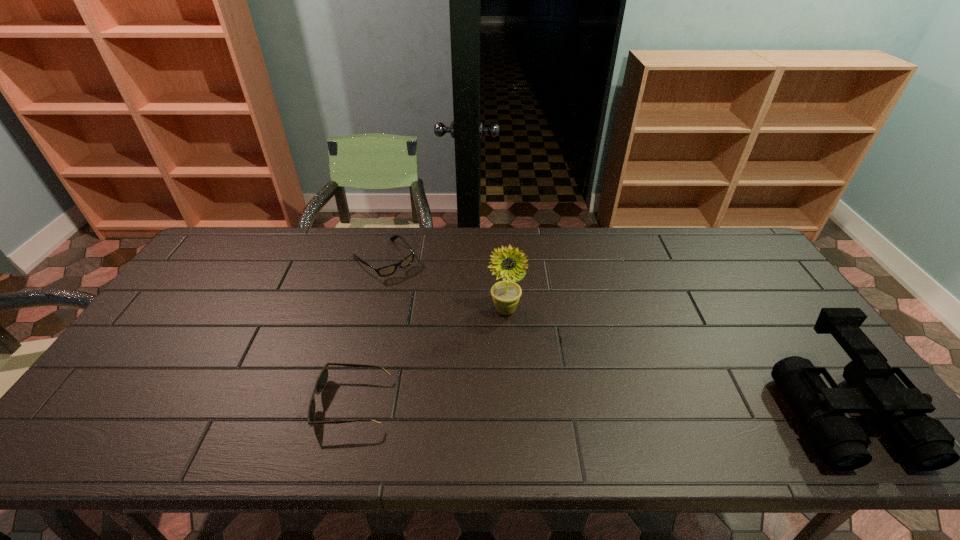
The height and width of the screenshot is (540, 960). I want to click on vacant region between the sunglasses and the binoculars, so click(595, 406).

Find the location of a particular element. This screenshot has height=540, width=960. unoccupied position between the farthest object and the sunflower is located at coordinates (444, 285).

At what (x,y) coordinates should I click in order to perform the action: click on free space between the farthest object and the tallest object. Please return your answer as a coordinate pair (x, y). Looking at the image, I should click on (444, 285).

Where is `vacant region between the spectacles and the rightmost object`? The height and width of the screenshot is (540, 960). vacant region between the spectacles and the rightmost object is located at coordinates (612, 335).

I want to click on the closest object relative to the spectacles, so click(506, 294).

At what (x,y) coordinates should I click in order to perform the action: click on object that is the second closest to the spectacles. Please return your answer as a coordinate pair (x, y). Looking at the image, I should click on (322, 379).

At what (x,y) coordinates should I click in order to perform the action: click on free space that satisfies the following two spatial constraints: 1. on the front side of the sunglasses; 2. on the lenses of the farthest object. Please return your answer as a coordinate pair (x, y). The height and width of the screenshot is (540, 960). Looking at the image, I should click on click(347, 402).